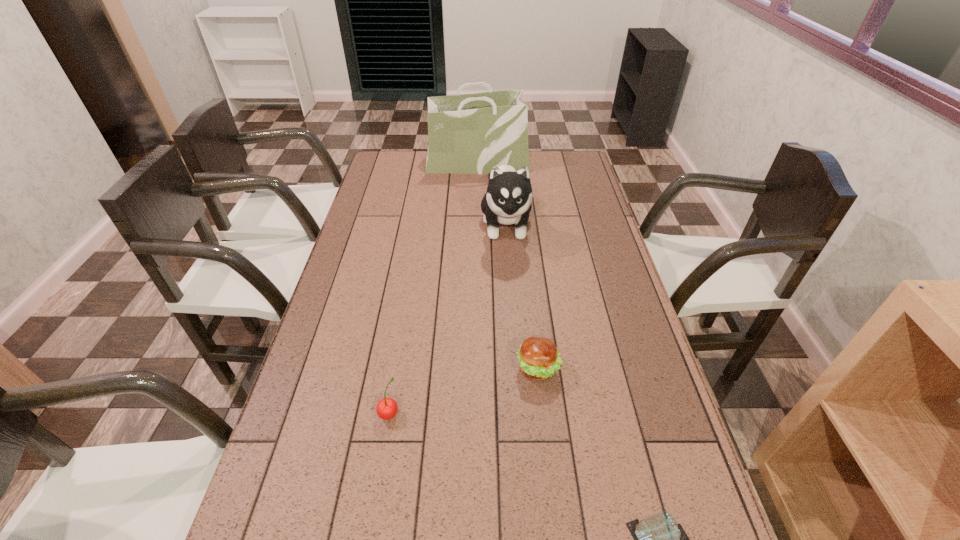
Locate an element on the screen. This screenshot has height=540, width=960. unoccupied position between the hamburger and the fourth nearest object is located at coordinates (522, 296).

Where is `empty location between the second nearest object and the third nearest object`? empty location between the second nearest object and the third nearest object is located at coordinates (464, 391).

Identify which object is located as the third nearest to the nearest object. Please provide its 2D coordinates. Your answer should be formatted as a tuple, i.e. [(x, y)], where the tuple contains the x and y coordinates of a point satisfying the conditions above.

[(508, 198)]

Identify the location of object that is the fourth closest to the puppy. (659, 539).